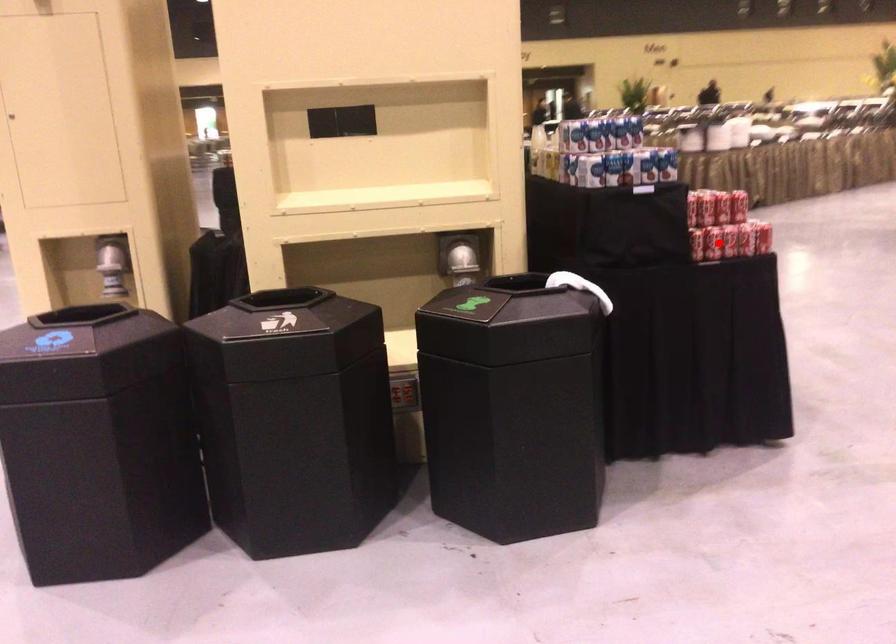
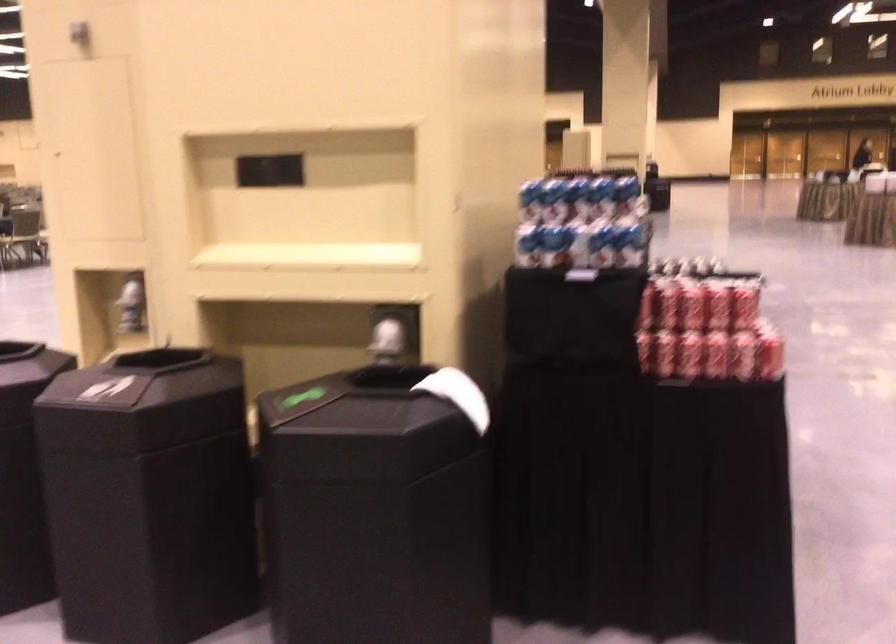
Question: I am providing you with two images of the same scene from different viewpoints. Image1 has a red point marked. In image2, the corresponding 3D location appears at what relative position? Reply with the corresponding letter.

Choices:
 (A) Closer
 (B) Farther

Answer: (A)